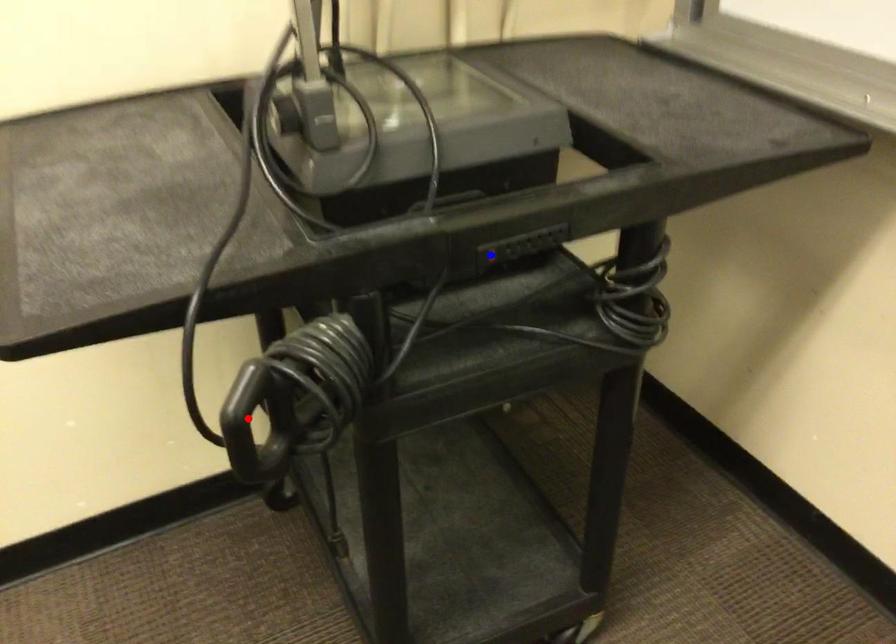
Question: In the image, two points are highlighted. Which point is nearer to the camera? Reply with the corresponding letter.

Choices:
 (A) blue point
 (B) red point

Answer: (B)